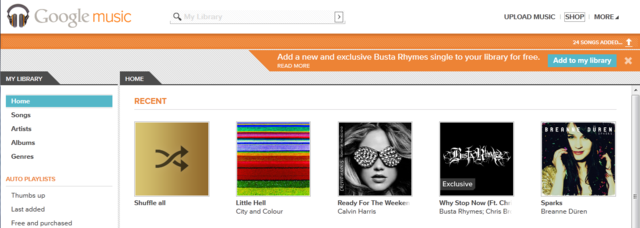
Where is `empty space right of my library`? This screenshot has height=228, width=640. empty space right of my library is located at coordinates (80, 67).